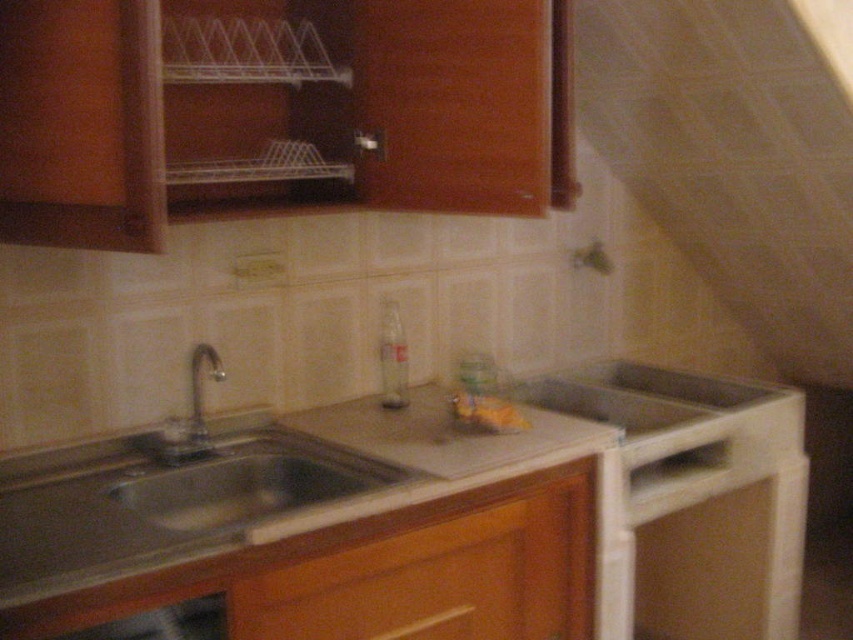
You are a kitchen designer planning to install a new appliance. You have a white matte exhaust hood at upper right and a wooden drawer at lower center in your design. Which object should you prioritize in terms of space allocation, and why?

The white matte exhaust hood at upper right requires more space because it is larger in size than the wooden drawer at lower center.

You are a chef preparing ingredients and need to place a cutting board on the closest surface. Which object should you choose between the smooth white countertop at center and the wooden drawer at lower center?

The smooth white countertop at center is closer to the viewer than the wooden drawer at lower center, so you should place the cutting board on the smooth white countertop at center.

You are standing in the kitchen and want to pick up the clear plastic located at point (666, 211). If you are currently 2.75 meters away from that point, how many steps do you need to take to reach it, assuming each step covers 0.75 meters?

Since the distance between you and the clear plastic at point (666, 211) is 2.75 meters and each step covers 0.75 meters, you would need to take 4 steps to reach it. This is because 2.75 divided by 0.75 equals approximately 3.666, which rounds up to 4 steps to ensure you cover the entire distance.